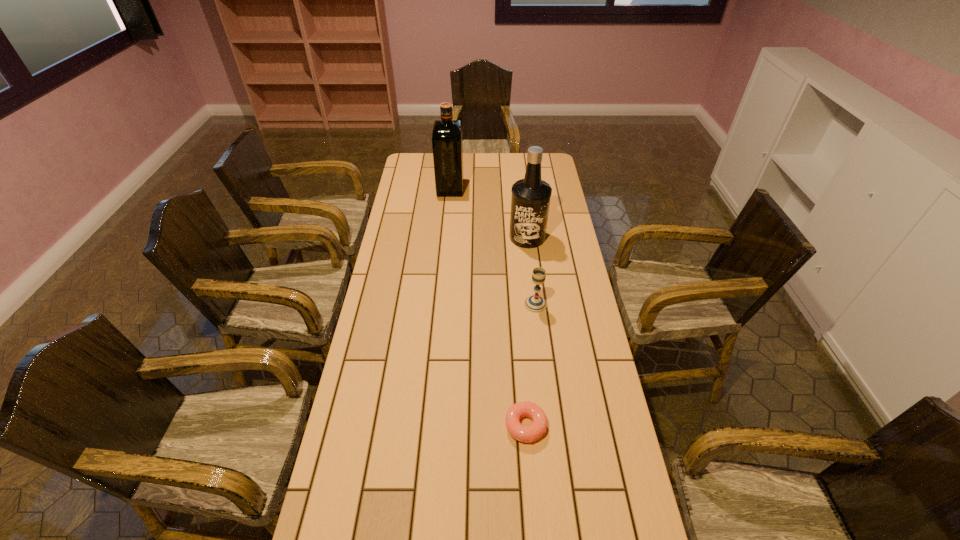
Where is `free space that satisfies the following two spatial constraints: 1. on the front label of the leftmost object; 2. on the left side of the third tallest object`? The image size is (960, 540). free space that satisfies the following two spatial constraints: 1. on the front label of the leftmost object; 2. on the left side of the third tallest object is located at coordinates [x=440, y=304].

In order to click on vacant space that satisfies the following two spatial constraints: 1. on the front label of the second shortest object; 2. on the right side of the leftmost object in this screenshot , I will do `click(440, 304)`.